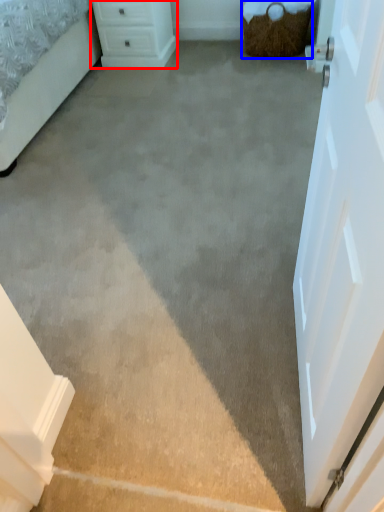
Question: Among these objects, which one is nearest to the camera, chest of drawers (highlighted by a red box) or basket (highlighted by a blue box)?

Choices:
 (A) chest of drawers
 (B) basket

Answer: (B)